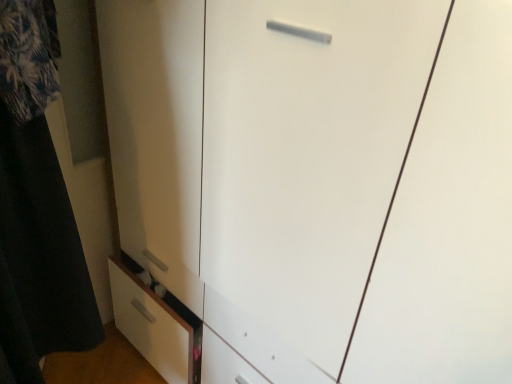
This screenshot has width=512, height=384. What do you see at coordinates (36, 207) in the screenshot?
I see `black fabric at left` at bounding box center [36, 207].

The image size is (512, 384). I want to click on black fabric at left, so click(x=36, y=207).

The image size is (512, 384). Identify the location of black fabric at left. (36, 207).